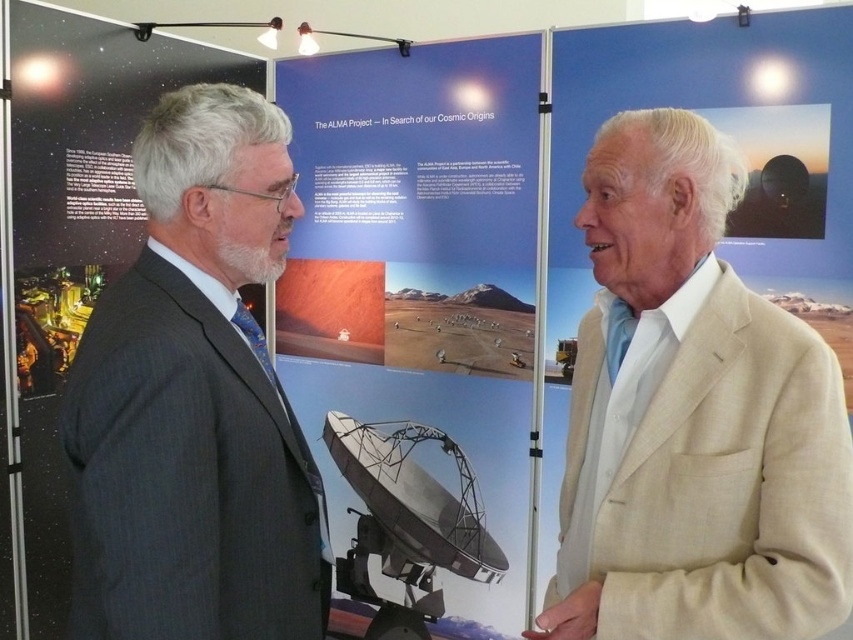
Question: Does beige linen suit at right have a lesser width compared to dark gray suit at left?

Choices:
 (A) no
 (B) yes

Answer: (A)

Question: Which object is the closest to the dark gray suit at left?

Choices:
 (A) beige linen suit at right
 (B) matte black satellite dish at center

Answer: (A)

Question: Is beige linen suit at right above dark gray suit at left?

Choices:
 (A) yes
 (B) no

Answer: (B)

Question: Among these points, which one is nearest to the camera?

Choices:
 (A) (717, 230)
 (B) (355, 65)

Answer: (A)

Question: Which object is farther from the camera taking this photo?

Choices:
 (A) beige linen suit at right
 (B) dark gray suit at left

Answer: (A)

Question: Where is beige linen suit at right located in relation to matte black satellite dish at center in the image?

Choices:
 (A) above
 (B) below

Answer: (B)